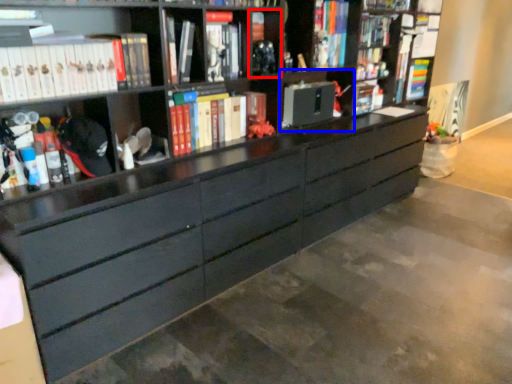
Question: Which of the following is the closest to the observer, cabinet (highlighted by a red box) or cabinet (highlighted by a blue box)?

Choices:
 (A) cabinet
 (B) cabinet

Answer: (A)